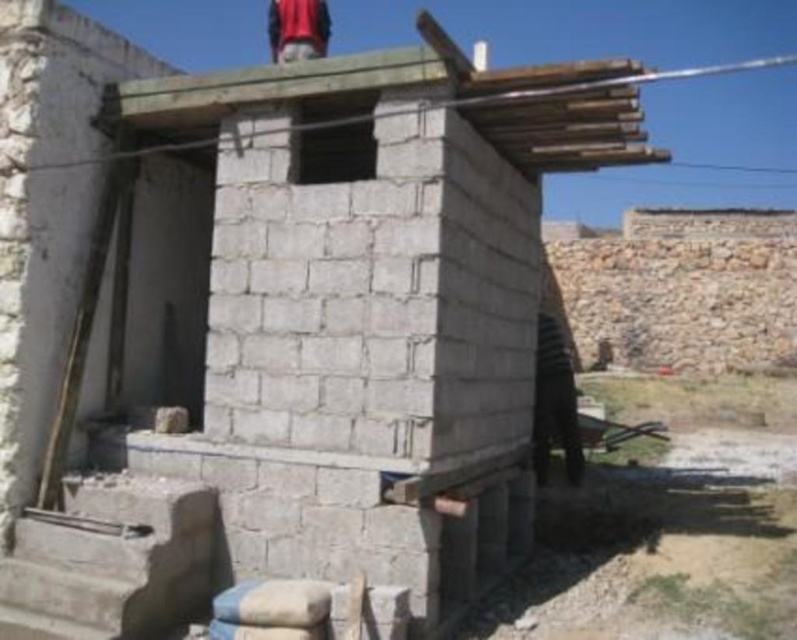
Looking at this image, does smooth wooden boards at upper center have a lesser height compared to dark brown leather jacket at lower right?

Correct, smooth wooden boards at upper center is not as tall as dark brown leather jacket at lower right.

Does point (544, 129) lie behind point (568, 456)?

No.

Is point (587, 104) in front of point (538, 438)?

Yes, it is in front of point (538, 438).

At what (x,y) coordinates should I click in order to perform the action: click on smooth wooden boards at upper center. Please return your answer as a coordinate pair (x, y). The image size is (797, 640). Looking at the image, I should click on (336, 83).

Between dark brown leather jacket at lower right and red fabric at upper center, which one has more height?

Result: red fabric at upper center is taller.

Who is higher up, dark brown leather jacket at lower right or red fabric at upper center?

red fabric at upper center

The height and width of the screenshot is (640, 797). What are the coordinates of `dark brown leather jacket at lower right` in the screenshot? It's located at (554, 403).

I want to click on dark brown leather jacket at lower right, so click(554, 403).

Measure the distance between smooth wooden boards at upper center and red fabric at upper center.

3.91 meters

Can you confirm if smooth wooden boards at upper center is positioned to the right of red fabric at upper center?

Correct, you'll find smooth wooden boards at upper center to the right of red fabric at upper center.

Is point (587, 131) positioned after point (297, 28)?

That is False.

Identify the location of smooth wooden boards at upper center. The image size is (797, 640). (336, 83).